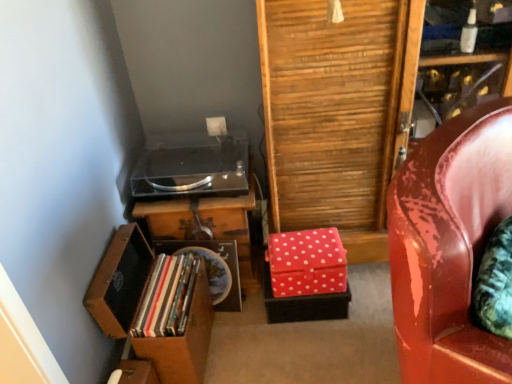
Question: Is wooden table at center wider than matte plastic books at lower left?

Choices:
 (A) yes
 (B) no

Answer: (B)

Question: From the image's perspective, is wooden table at center located above matte plastic books at lower left?

Choices:
 (A) yes
 (B) no

Answer: (A)

Question: From the image's perspective, is wooden table at center located beneath matte plastic books at lower left?

Choices:
 (A) yes
 (B) no

Answer: (B)

Question: Does wooden table at center have a lesser width compared to matte plastic books at lower left?

Choices:
 (A) no
 (B) yes

Answer: (B)

Question: Is matte plastic books at lower left located within wooden table at center?

Choices:
 (A) yes
 (B) no

Answer: (B)

Question: Considering their positions, is glossy leather chair at right located in front of or behind red polka dot fabric box at lower right?

Choices:
 (A) front
 (B) behind

Answer: (A)

Question: From a real-world perspective, relative to red polka dot fabric box at lower right, is glossy leather chair at right vertically above or below?

Choices:
 (A) above
 (B) below

Answer: (A)

Question: Considering the positions of glossy leather chair at right and red polka dot fabric box at lower right in the image, is glossy leather chair at right taller or shorter than red polka dot fabric box at lower right?

Choices:
 (A) short
 (B) tall

Answer: (B)

Question: Is point (480, 332) positioned closer to the camera than point (340, 243)?

Choices:
 (A) closer
 (B) farther

Answer: (A)

Question: Considering the positions of transparent acrylic stereo at center and matte plastic books at lower left in the image, is transparent acrylic stereo at center taller or shorter than matte plastic books at lower left?

Choices:
 (A) tall
 (B) short

Answer: (A)

Question: From the image's perspective, is transparent acrylic stereo at center above or below matte plastic books at lower left?

Choices:
 (A) below
 (B) above

Answer: (B)

Question: Considering the positions of transparent acrylic stereo at center and matte plastic books at lower left in the image, is transparent acrylic stereo at center wider or thinner than matte plastic books at lower left?

Choices:
 (A) wide
 (B) thin

Answer: (A)

Question: In the image, is transparent acrylic stereo at center on the left side or the right side of matte plastic books at lower left?

Choices:
 (A) right
 (B) left

Answer: (A)

Question: Considering the positions of wooden table at center and glossy leather chair at right in the image, is wooden table at center wider or thinner than glossy leather chair at right?

Choices:
 (A) wide
 (B) thin

Answer: (B)

Question: Is wooden table at center in front of or behind glossy leather chair at right in the image?

Choices:
 (A) front
 (B) behind

Answer: (B)